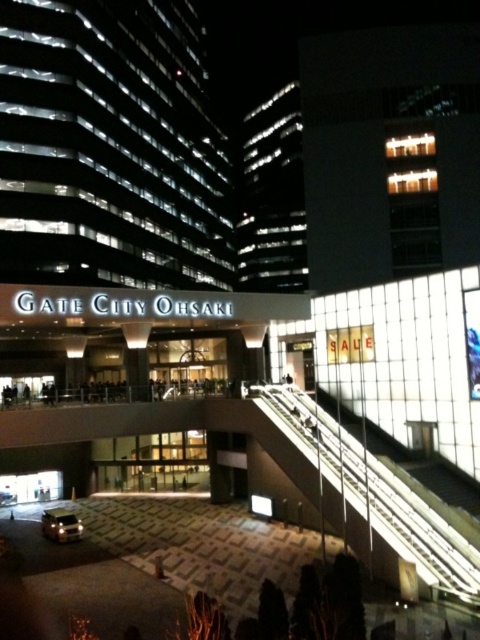
Does transparent glass escalator at center have a greater width compared to shiny silver suv at lower left?

Yes.

Is transparent glass escalator at center bigger than shiny silver suv at lower left?

Indeed, transparent glass escalator at center has a larger size compared to shiny silver suv at lower left.

Where is `transparent glass escalator at center`? The image size is (480, 640). transparent glass escalator at center is located at coordinates (374, 492).

Locate an element on the screen. The image size is (480, 640). transparent glass escalator at center is located at coordinates (374, 492).